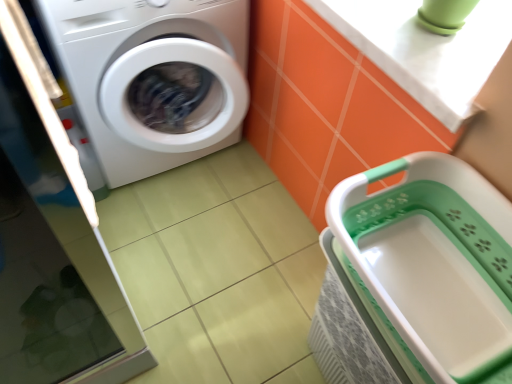
This screenshot has height=384, width=512. In order to click on white glossy counter top at upper right in this screenshot , I will do `click(426, 49)`.

Could white glossy washing machine at left be considered to be inside white glossy counter top at upper right?

No, white glossy counter top at upper right does not contain white glossy washing machine at left.

From a real-world perspective, is white glossy counter top at upper right on white glossy washing machine at left?

Yes.

Is white glossy counter top at upper right not close to white glossy washing machine at left?

They are positioned close to each other.

Is white glossy counter top at upper right smaller than white glossy washing machine at left?

Correct, white glossy counter top at upper right occupies less space than white glossy washing machine at left.

Which is behind, white plastic basket at lower right or white glossy washing machine at left?

white glossy washing machine at left is behind.

Is white plastic basket at lower right situated inside white glossy washing machine at left or outside?

white plastic basket at lower right cannot be found inside white glossy washing machine at left.

Is point (335, 286) closer or farther from the camera than point (185, 142)?

Point (335, 286).

I want to click on dish washer positioned vertically above the white glossy washing machine at left (from a real-world perspective), so click(x=418, y=277).

Are white plastic basket at lower right and white glossy counter top at upper right far apart?

Actually, white plastic basket at lower right and white glossy counter top at upper right are a little close together.

From the image's perspective, which is above, white plastic basket at lower right or white glossy counter top at upper right?

white glossy counter top at upper right is shown above in the image.

Could white glossy counter top at upper right be considered to be inside white plastic basket at lower right?

Actually, white glossy counter top at upper right is outside white plastic basket at lower right.

Measure the distance between white plastic basket at lower right and white glossy counter top at upper right.

The distance of white plastic basket at lower right from white glossy counter top at upper right is 33.88 centimeters.

Which of these two, white glossy washing machine at left or white glossy counter top at upper right, is wider?

white glossy washing machine at left.

In the image, is white glossy washing machine at left on the left side or the right side of white glossy counter top at upper right?

In the image, white glossy washing machine at left appears on the left side of white glossy counter top at upper right.

The width and height of the screenshot is (512, 384). In order to click on washing machine lying above the white glossy counter top at upper right (from the image's perspective) in this screenshot , I will do `click(152, 77)`.

Is white glossy washing machine at left bigger or smaller than white glossy counter top at upper right?

Clearly, white glossy washing machine at left is larger in size than white glossy counter top at upper right.

Is white glossy counter top at upper right directly adjacent to white plastic basket at lower right?

white glossy counter top at upper right and white plastic basket at lower right are not in contact.

From a real-world perspective, is white glossy counter top at upper right over white plastic basket at lower right?

Yes.

Can you confirm if white glossy counter top at upper right is positioned to the left of white plastic basket at lower right?

No.

Between point (450, 52) and point (409, 358), which one is positioned in front?

Positioned in front is point (409, 358).

From the image's perspective, which is below, white glossy washing machine at left or white plastic basket at lower right?

white plastic basket at lower right.

Can you confirm if white glossy washing machine at left is thinner than white plastic basket at lower right?

Incorrect, the width of white glossy washing machine at left is not less than that of white plastic basket at lower right.

Is white glossy washing machine at left to the right of white plastic basket at lower right from the viewer's perspective?

No, white glossy washing machine at left is not to the right of white plastic basket at lower right.

Would you say white glossy washing machine at left is inside or outside white plastic basket at lower right?

white glossy washing machine at left is not enclosed by white plastic basket at lower right.

This screenshot has width=512, height=384. In order to click on washing machine that is under the white glossy counter top at upper right (from a real-world perspective) in this screenshot , I will do `click(152, 77)`.

You are a GUI agent. You are given a task and a screenshot of the screen. Output one action in this format:
    pyautogui.click(x=<x>, y=<y>)
    Task: Click on the dish washer that appears below the white glossy washing machine at left (from the image's perspective)
    
    Given the screenshot: What is the action you would take?
    pyautogui.click(x=418, y=277)

Estimate the real-world distances between objects in this image. Which object is further from white plastic basket at lower right, white glossy washing machine at left or white glossy counter top at upper right?

Among the two, white glossy washing machine at left is located further to white plastic basket at lower right.

From the picture: Looking at the image, which one is located closer to white glossy washing machine at left, white glossy counter top at upper right or white plastic basket at lower right?

Among the two, white glossy counter top at upper right is located nearer to white glossy washing machine at left.

Which object lies further to the anchor point white glossy counter top at upper right, white glossy washing machine at left or white plastic basket at lower right?

white glossy washing machine at left is positioned further to the anchor white glossy counter top at upper right.

Estimate the real-world distances between objects in this image. Which object is further from white plastic basket at lower right, white glossy counter top at upper right or white glossy washing machine at left?

white glossy washing machine at left is positioned further to the anchor white plastic basket at lower right.

Estimate the real-world distances between objects in this image. Which object is closer to white glossy washing machine at left, white plastic basket at lower right or white glossy counter top at upper right?

The object closer to white glossy washing machine at left is white glossy counter top at upper right.

Estimate the real-world distances between objects in this image. Which object is further from white glossy counter top at upper right, white plastic basket at lower right or white glossy washing machine at left?

A: white glossy washing machine at left is further to white glossy counter top at upper right.

The width and height of the screenshot is (512, 384). I want to click on dish washer situated between white glossy washing machine at left and white glossy counter top at upper right from left to right, so click(418, 277).